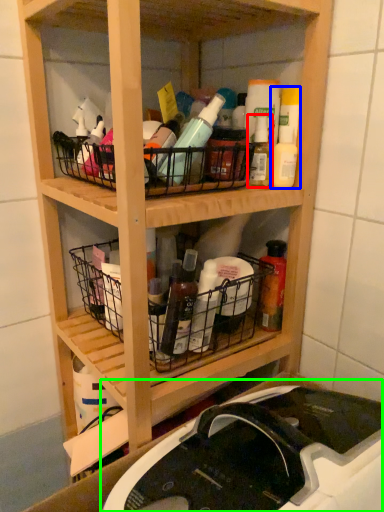
Question: Considering the real-world distances, which object is closest to bottle (highlighted by a red box)? cleaning product (highlighted by a blue box) or sink (highlighted by a green box).

Choices:
 (A) cleaning product
 (B) sink

Answer: (A)